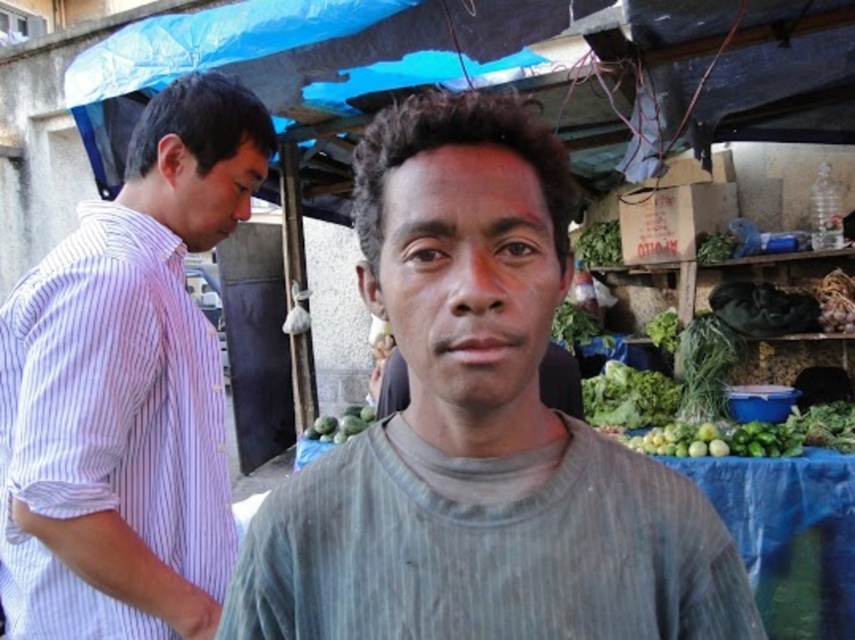
Question: Does dark curly hair at center come in front of green matte melon at center?

Choices:
 (A) no
 (B) yes

Answer: (B)

Question: Can you confirm if gray cotton shirt at center is positioned below purple striped shirt at left?

Choices:
 (A) yes
 (B) no

Answer: (A)

Question: Does green leafy at center appear under green matte melon at center?

Choices:
 (A) yes
 (B) no

Answer: (B)

Question: Considering the real-world distances, which object is farthest from the green leafy at right?

Choices:
 (A) green matte melon at center
 (B) green leafy at center

Answer: (A)

Question: Among these points, which one is nearest to the camera?

Choices:
 (A) (417, 220)
 (B) (623, 390)
 (C) (338, 429)
 (D) (545, 177)

Answer: (A)

Question: Which object is closer to the camera taking this photo?

Choices:
 (A) purple striped shirt at left
 (B) gray cotton shirt at center

Answer: (B)